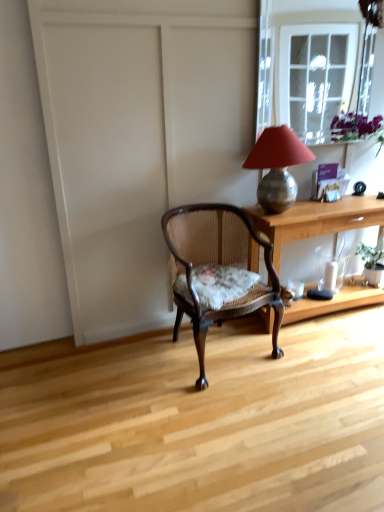
The height and width of the screenshot is (512, 384). I want to click on free point to the right of wooden cane chair with floral cushion at center, so click(x=312, y=362).